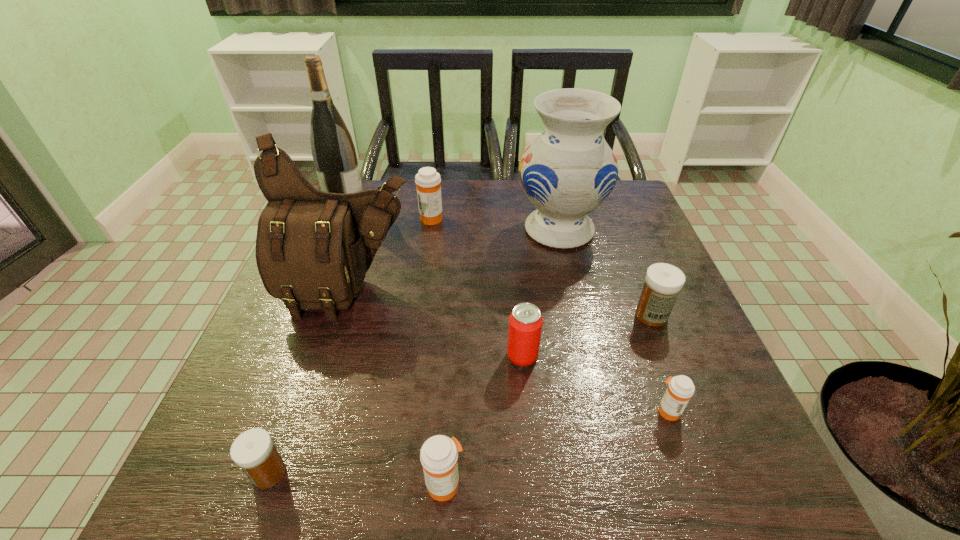
At what (x,y) coordinates should I click in order to perform the action: click on free spot located on the back of the farther white medicine. Please return your answer as a coordinate pair (x, y). Looking at the image, I should click on (614, 222).

At what (x,y) coordinates should I click in order to perform the action: click on vacant point located on the back of the nearest orange medicine. Please return your answer as a coordinate pair (x, y). The width and height of the screenshot is (960, 540). Looking at the image, I should click on (450, 397).

Locate an element on the screen. free space located on the front of the rightmost orange medicine is located at coordinates (692, 479).

Where is `vacant space located 0.250m on the right of the left white medicine`? vacant space located 0.250m on the right of the left white medicine is located at coordinates (442, 473).

Where is `wine bottle situated at the far edge`? The height and width of the screenshot is (540, 960). wine bottle situated at the far edge is located at coordinates (333, 151).

Locate an element on the screen. vase at the far edge is located at coordinates (569, 170).

At what (x,y) coordinates should I click in order to perform the action: click on medicine positioned at the far edge. Please return your answer as a coordinate pair (x, y). This screenshot has height=540, width=960. Looking at the image, I should click on (428, 181).

Find the location of `wine bottle positioned at the left edge`. wine bottle positioned at the left edge is located at coordinates (333, 151).

The image size is (960, 540). What are the coordinates of `shoulder bag that is at the left edge` in the screenshot? It's located at [313, 248].

At what (x,y) coordinates should I click in order to perform the action: click on medicine that is at the left edge. Please return your answer as a coordinate pair (x, y). The height and width of the screenshot is (540, 960). Looking at the image, I should click on (253, 451).